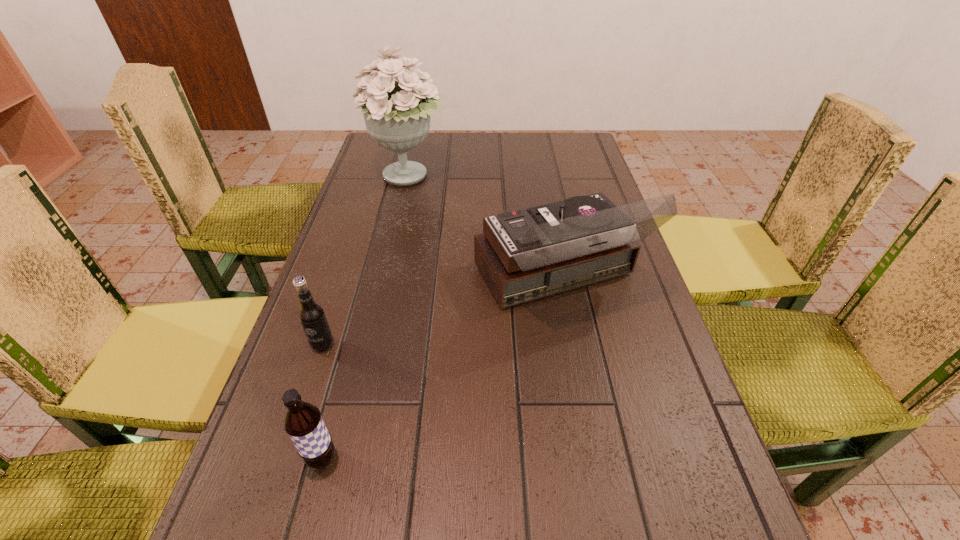
Find the location of a particular element. Image resolution: width=960 pixels, height=540 pixels. bouquet is located at coordinates (397, 114).

Locate an element on the screen. the tallest object is located at coordinates (397, 114).

Identify the location of record player. The width and height of the screenshot is (960, 540). (527, 254).

Where is `the rightmost object`? the rightmost object is located at coordinates 527,254.

You are a GUI agent. You are given a task and a screenshot of the screen. Output one action in this format:
    pyautogui.click(x=<x>, y=<y>)
    Task: Click on the right root beer
    The image size is (960, 540).
    Given the screenshot: What is the action you would take?
    pyautogui.click(x=303, y=423)

At what (x,y) coordinates should I click in order to perform the action: click on the nearer root beer. Please return your answer as a coordinate pair (x, y). This screenshot has height=540, width=960. Looking at the image, I should click on (303, 423).

Where is `the left root beer`? The image size is (960, 540). the left root beer is located at coordinates click(x=311, y=315).

Where is `vacant space located on the right of the farthest object`? The width and height of the screenshot is (960, 540). vacant space located on the right of the farthest object is located at coordinates (564, 177).

Identify the location of blank space located 0.110m on the left of the rightmost object. This screenshot has height=540, width=960. (427, 279).

Find the location of `free space located 0.400m on the back of the nearer root beer`. free space located 0.400m on the back of the nearer root beer is located at coordinates (370, 279).